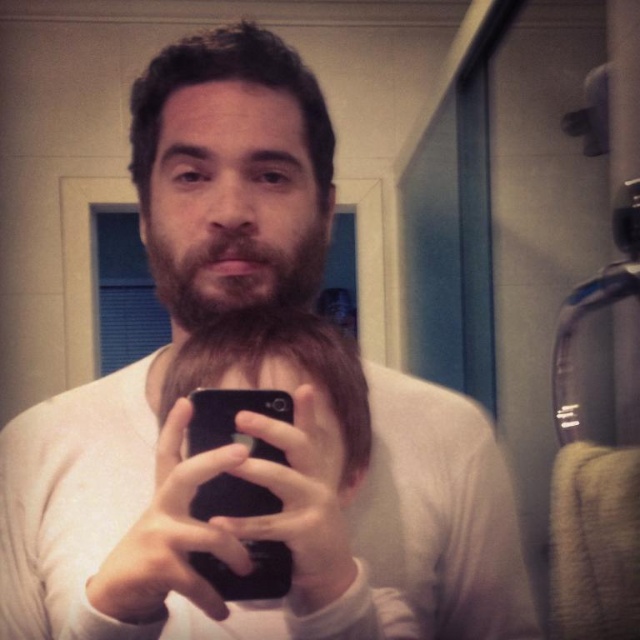
Question: Is brownwoollybeard at center to the left of black matte smartphone at center from the viewer's perspective?

Choices:
 (A) yes
 (B) no

Answer: (A)

Question: Estimate the real-world distances between objects in this image. Which object is farther from the brownwoollybeard at center?

Choices:
 (A) black matte smartphone at center
 (B) black matte phone at center

Answer: (A)

Question: Where is brownwoollybeard at center located in relation to black matte smartphone at center in the image?

Choices:
 (A) above
 (B) below

Answer: (A)

Question: Which object appears farthest from the camera in this image?

Choices:
 (A) brownwoollybeard at center
 (B) black matte phone at center
 (C) black matte smartphone at center

Answer: (A)

Question: Does black matte phone at center have a smaller size compared to brownwoollybeard at center?

Choices:
 (A) no
 (B) yes

Answer: (A)

Question: Among these objects, which one is nearest to the camera?

Choices:
 (A) black matte smartphone at center
 (B) brownwoollybeard at center
 (C) black matte phone at center

Answer: (C)